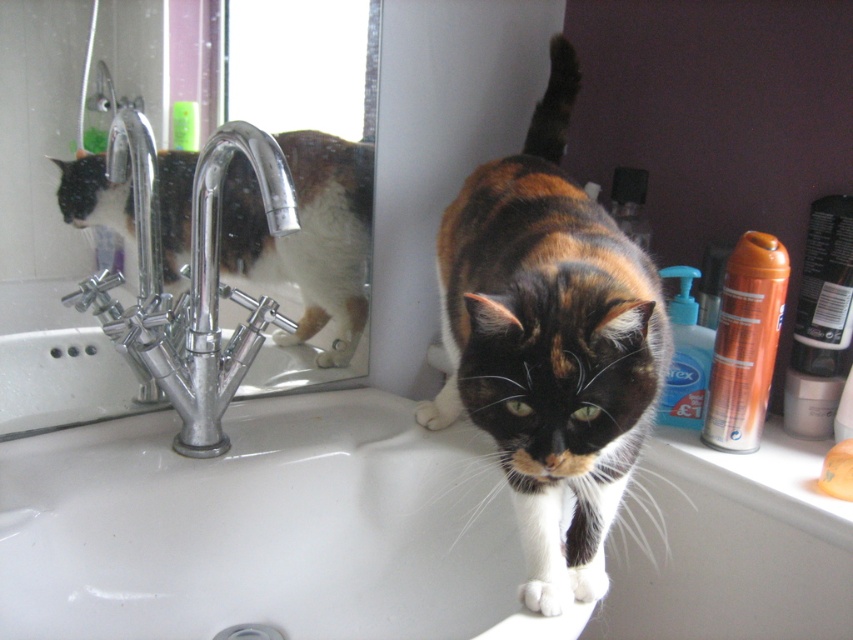
You are a home inspector evaluating the bathroom layout. You notice the white glossy sink at center and the calico fur cat at center. Based on their spatial relationship, which object takes up more area in the image?

The calico fur cat at center takes up more area in the image than the white glossy sink at center because the white glossy sink at center occupies less space than calico fur cat at center.

You are a bathroom designer planning to install a new faucet. The current faucet is located at point (264, 529), which marks the white glossy sink at center. Where should the new faucet be placed to ensure it is positioned 5 cm to the right of the existing faucet?

The new faucet should be placed 5 cm to the right of the existing faucet at point (264, 529), which marks the white glossy sink at center.